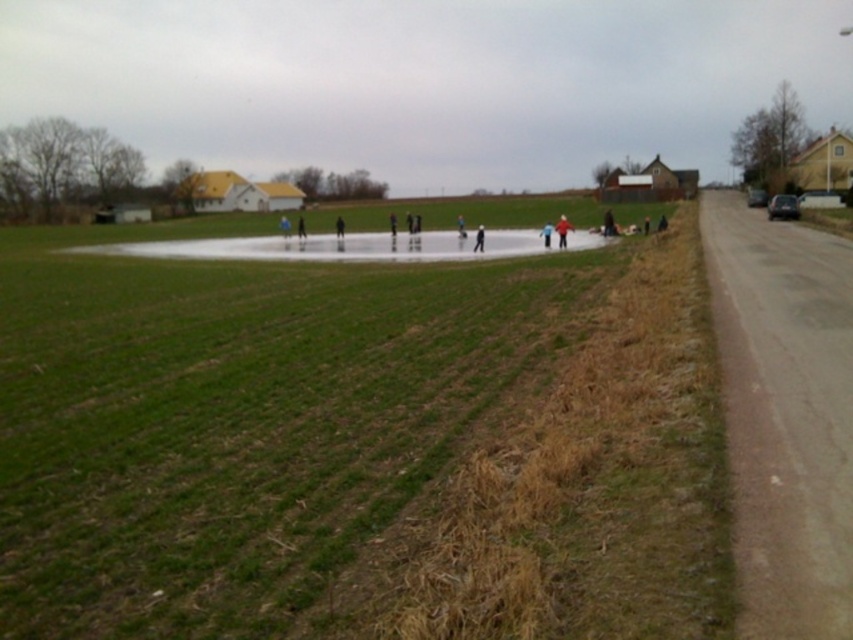
Question: In this image, where is green grass at center located relative to light blue fabric jacket at center?

Choices:
 (A) below
 (B) above

Answer: (A)

Question: Is green grass at center positioned behind light blue fabric jacket at center?

Choices:
 (A) no
 (B) yes

Answer: (A)

Question: Among these points, which one is nearest to the camera?

Choices:
 (A) (563, 237)
 (B) (691, 598)

Answer: (B)

Question: Can you confirm if green grass at center is positioned to the right of light blue fabric jacket at center?

Choices:
 (A) yes
 (B) no

Answer: (B)